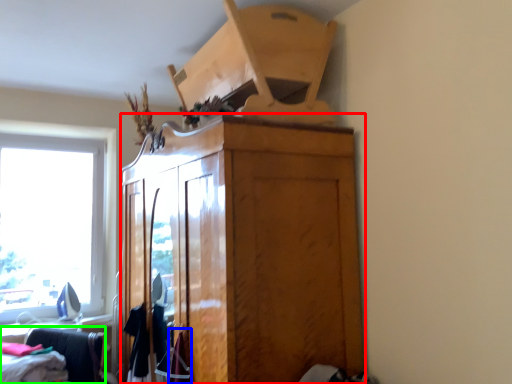
Question: Based on their relative distances, which object is farther from cabinetry (highlighted by a red box)? Choose from clothing (highlighted by a blue box) and furniture (highlighted by a green box).

Choices:
 (A) clothing
 (B) furniture

Answer: (B)